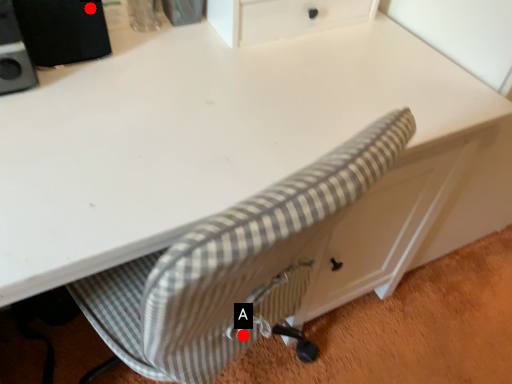
Question: Two points are circled on the image, labeled by A and B beside each circle. Among these points, which one is nearest to the camera?

Choices:
 (A) A is closer
 (B) B is closer

Answer: (A)